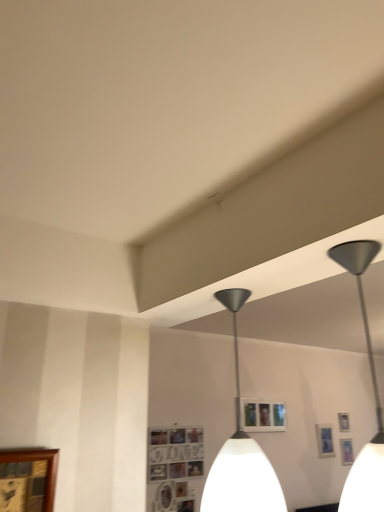
Question: From a real-world perspective, is metallic silver picture frame at upper right, which is the third picture frame from left to right, above or below metallic gray pendant light at center?

Choices:
 (A) above
 (B) below

Answer: (B)

Question: Considering the positions of metallic silver picture frame at upper right, arranged as the 2th picture frame when viewed from the right, and metallic gray pendant light at center in the image, is metallic silver picture frame at upper right, arranged as the 2th picture frame when viewed from the right, taller or shorter than metallic gray pendant light at center?

Choices:
 (A) tall
 (B) short

Answer: (B)

Question: Which of these objects is positioned closest to the metallic gray pendant light at center?

Choices:
 (A) metallic silver picture frame at upper right, arranged as the 2th picture frame when viewed from the right
 (B) wooden photo frame at lower center, which is counted as the second picture frame, starting from the top
 (C) wooden picture frame at lower left, which appears as the fourth picture frame when viewed from the back
 (D) metallic silver picture frame at upper right, arranged as the third picture frame when viewed from the front

Answer: (B)

Question: Which of these objects is positioned closest to the wooden photo frame at lower center, which is the 3th picture frame in back-to-front order?

Choices:
 (A) metallic gray pendant light at center
 (B) wooden picture frame at lower left, positioned as the 1th picture frame in top-to-bottom order
 (C) metallic silver picture frame at upper right, which is the third picture frame from left to right
 (D) metallic silver picture frame at upper right, the 1th picture frame in the right-to-left sequence

Answer: (A)